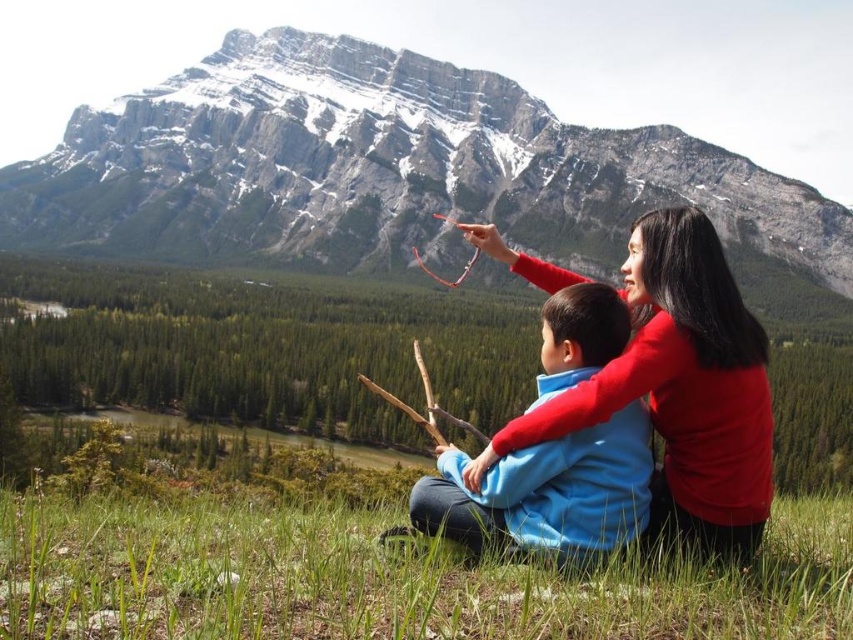
Question: Which point is farther from the camera taking this photo?

Choices:
 (A) (215, 257)
 (B) (498, 468)
 (C) (641, 369)

Answer: (A)

Question: Does red matte sweater at center appear under blue fleece jacket at center?

Choices:
 (A) no
 (B) yes

Answer: (A)

Question: Can you confirm if snowy granite mountain at upper center is thinner than red matte sweater at center?

Choices:
 (A) no
 (B) yes

Answer: (A)

Question: Which of the following is the farthest from the observer?

Choices:
 (A) blue fleece jacket at center
 (B) snowy granite mountain at upper center
 (C) red matte sweater at center

Answer: (B)

Question: Is snowy granite mountain at upper center bigger than blue fleece jacket at center?

Choices:
 (A) no
 (B) yes

Answer: (B)

Question: Which point is farther to the camera?

Choices:
 (A) red matte sweater at center
 (B) snowy granite mountain at upper center

Answer: (B)